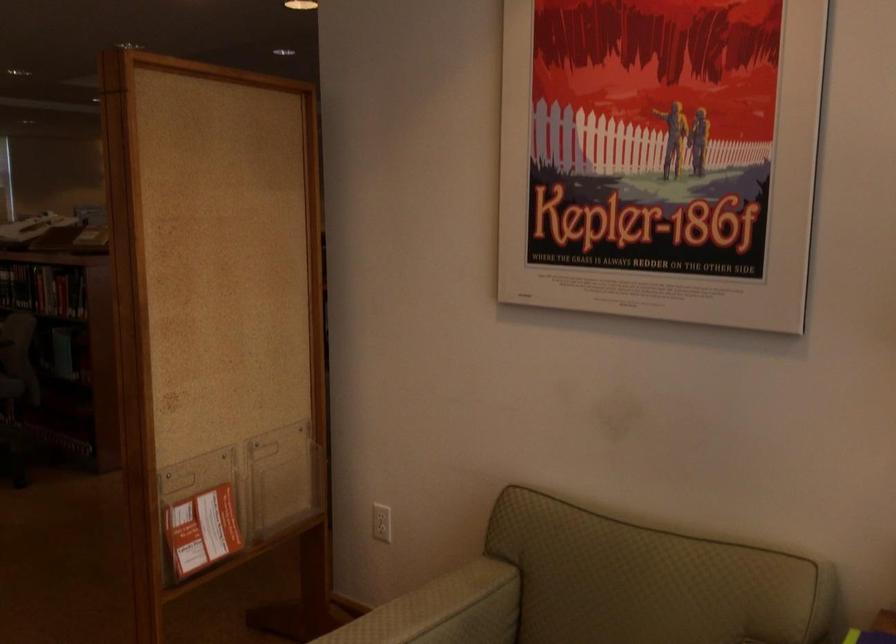
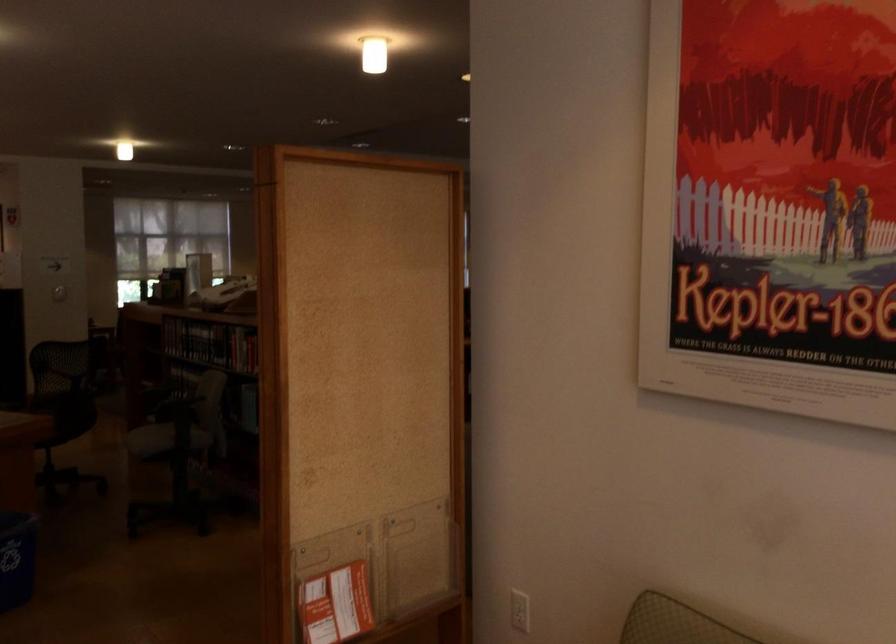
Question: The images are taken continuously from a first-person perspective. In which direction is your viewpoint rotating?

Choices:
 (A) Left
 (B) Right
 (C) Up
 (D) Down

Answer: (A)